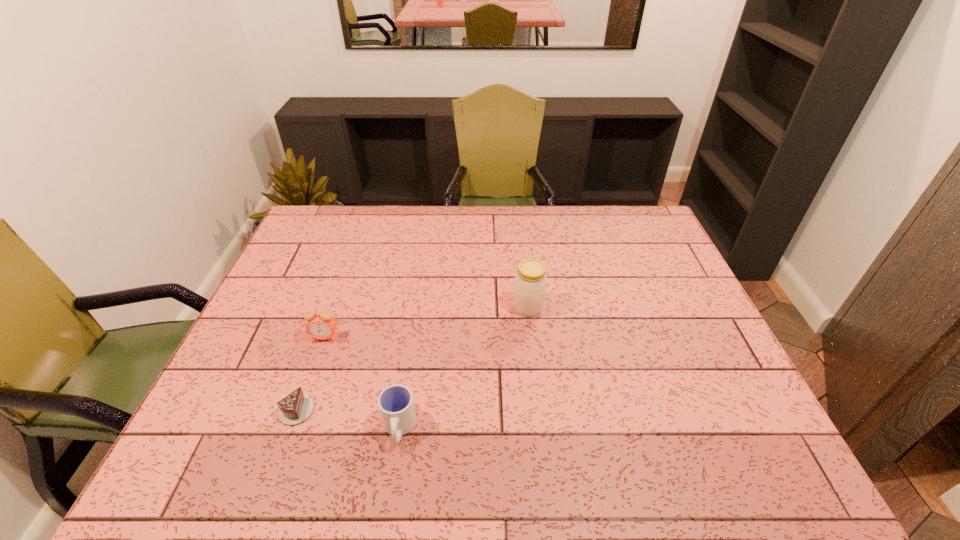
Find the location of `free area in between the jar and the chocolate cake`. free area in between the jar and the chocolate cake is located at coordinates (411, 359).

The image size is (960, 540). In order to click on vacant area that lies between the third shortest object and the farthest object in this screenshot , I will do `click(426, 322)`.

Identify the location of free area in between the second tallest object and the shortest object. [x=310, y=374].

This screenshot has height=540, width=960. In order to click on empty space that is in between the third object from left to right and the second farthest object in this screenshot , I will do `click(362, 383)`.

Image resolution: width=960 pixels, height=540 pixels. In order to click on vacant point located between the shortest object and the tallest object in this screenshot , I will do `click(411, 359)`.

The image size is (960, 540). In order to click on vacant area that lies between the third object from left to right and the rightmost object in this screenshot , I will do 464,368.

Where is `free point between the second tallest object and the shortest object`? free point between the second tallest object and the shortest object is located at coordinates pyautogui.click(x=310, y=374).

Identify the location of the closest object relative to the cup. (296, 407).

Point out which object is positioned as the second nearest to the third shortest object. Please provide its 2D coordinates. Your answer should be formatted as a tuple, i.e. [(x, y)], where the tuple contains the x and y coordinates of a point satisfying the conditions above.

[(396, 405)]